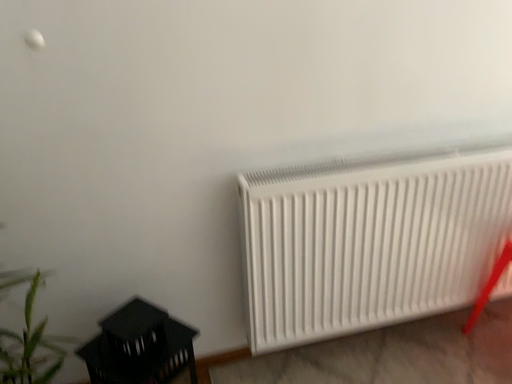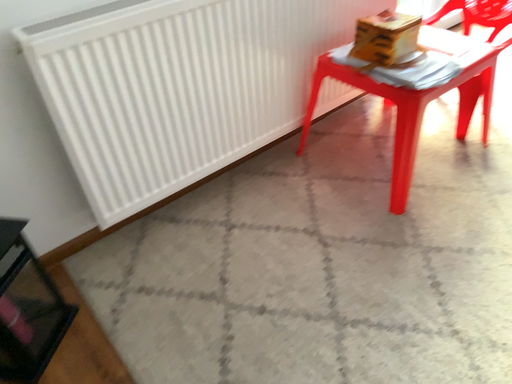
Question: How did the camera likely rotate when shooting the video?

Choices:
 (A) rotated downward
 (B) rotated upward

Answer: (A)